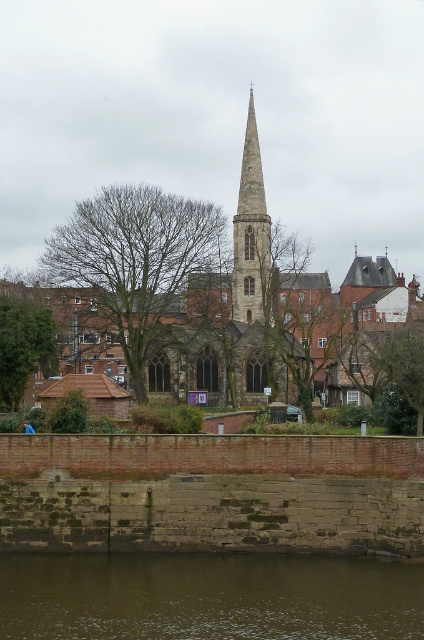
Question: Is brown muddy water at lower center above green leafy tree at left?

Choices:
 (A) yes
 (B) no

Answer: (B)

Question: Can you confirm if stone church at center is wider than green leafy tree at lower right?

Choices:
 (A) yes
 (B) no

Answer: (A)

Question: Which point appears farthest from the camera in this image?

Choices:
 (A) (44, 360)
 (B) (264, 252)
 (C) (382, 618)
 (D) (61, 273)

Answer: (B)

Question: Does brown muddy water at lower center appear on the right side of green leafy tree at lower right?

Choices:
 (A) no
 (B) yes

Answer: (A)

Question: Estimate the real-world distances between objects in this image. Which object is farther from the bare branches at center?

Choices:
 (A) smooth stone spire at center
 (B) stone church at center
 (C) brown muddy water at lower center
 (D) green leafy tree at left

Answer: (C)

Question: Which object is farther from the camera taking this photo?

Choices:
 (A) green leafy tree at left
 (B) stone church at center
 (C) smooth stone spire at center

Answer: (C)